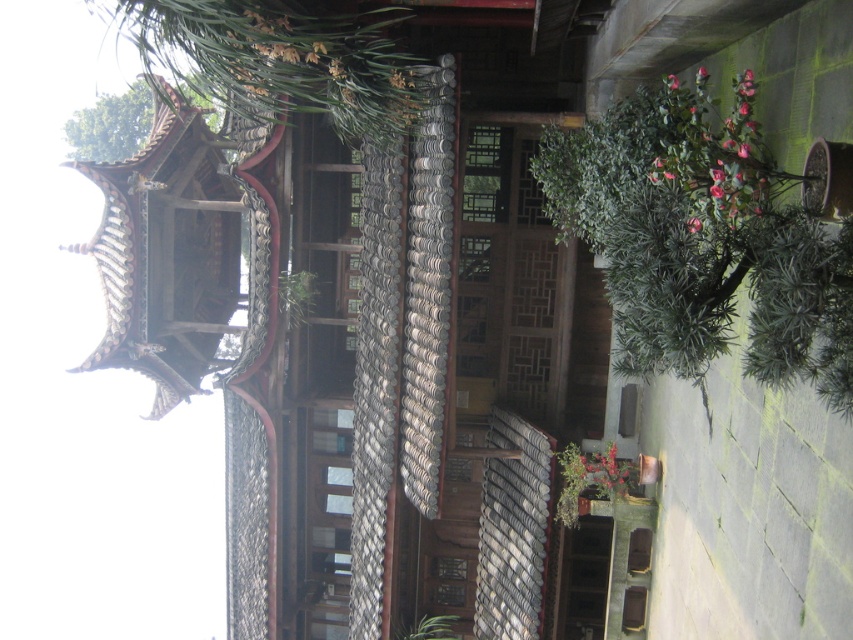
Which is more to the right, green leafy plant at right or green leafy plant at center?

green leafy plant at right is more to the right.

Does green leafy plant at right have a lesser width compared to green leafy plant at center?

No, green leafy plant at right is not thinner than green leafy plant at center.

Locate an element on the screen. The height and width of the screenshot is (640, 853). green leafy plant at right is located at coordinates (701, 240).

This screenshot has height=640, width=853. What are the coordinates of `green leafy plant at right` in the screenshot? It's located at pyautogui.click(x=701, y=240).

Is green matte plant at lower center thinner than green leafy plant at center?

In fact, green matte plant at lower center might be wider than green leafy plant at center.

Between point (592, 477) and point (283, 275), which one is positioned behind?

Positioned behind is point (283, 275).

Who is more distant from viewer, (585, 465) or (289, 305)?

The point (289, 305) is behind.

This screenshot has width=853, height=640. Identify the location of green matte plant at lower center. (590, 480).

Which is behind, point (349, 58) or point (561, 460)?

Positioned behind is point (561, 460).

Who is positioned more to the left, green leafy plant at upper left or green matte plant at lower center?

Positioned to the left is green leafy plant at upper left.

Where is `green leafy plant at upper left`? green leafy plant at upper left is located at coordinates (281, 60).